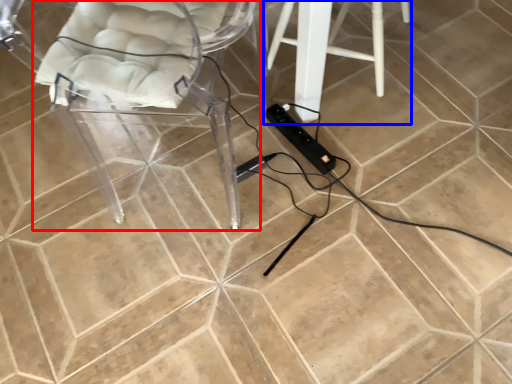
Question: Which point is further to the camera, chair (highlighted by a red box) or furniture (highlighted by a blue box)?

Choices:
 (A) chair
 (B) furniture

Answer: (B)